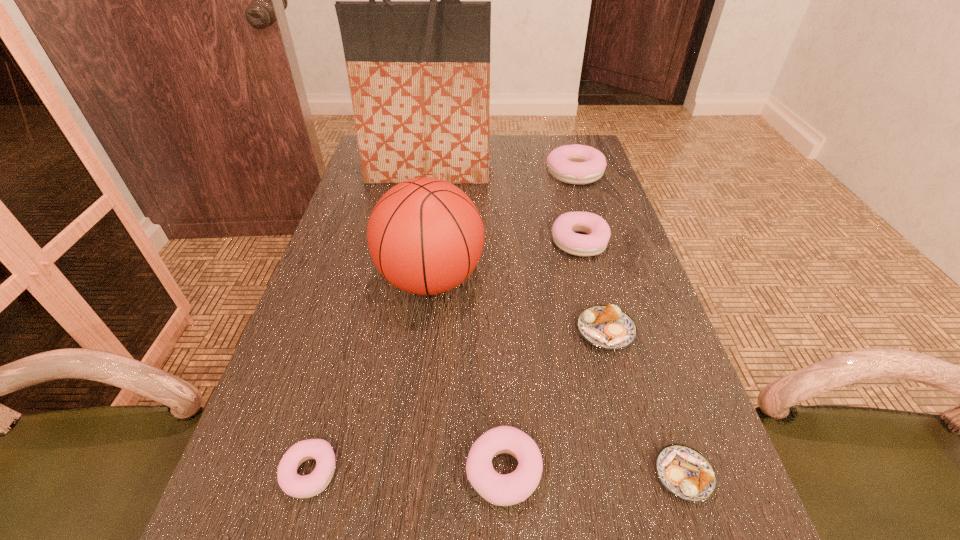
The image size is (960, 540). In the image, there is a desktop. Identify the location of vacant region at the right edge. (627, 505).

Identify the location of vacant region at the far right corner. (580, 137).

I want to click on vacant space that is in between the leftmost pastry and the basketball, so click(x=371, y=376).

Image resolution: width=960 pixels, height=540 pixels. In order to click on free space between the third farthest pastry and the leftmost pastry in this screenshot , I will do `click(458, 402)`.

This screenshot has width=960, height=540. Identify the location of free space between the tallest object and the third farthest pastry. (516, 252).

In order to click on free area in between the biggest pink pastry and the leftmost pastry in this screenshot , I will do `click(443, 323)`.

This screenshot has width=960, height=540. In order to click on empty space between the fifth shortest object and the second pink pastry from left to right in this screenshot , I will do `click(541, 356)`.

The image size is (960, 540). Identify the location of vacant point located between the smaller brown pastry and the second tallest object. (557, 377).

The image size is (960, 540). Identify the location of unoccupied position between the farthest pink pastry and the smallest pink pastry. (443, 323).

Where is `vacant space in between the smallest pink pastry and the tallest pastry`? The height and width of the screenshot is (540, 960). vacant space in between the smallest pink pastry and the tallest pastry is located at coordinates (443, 323).